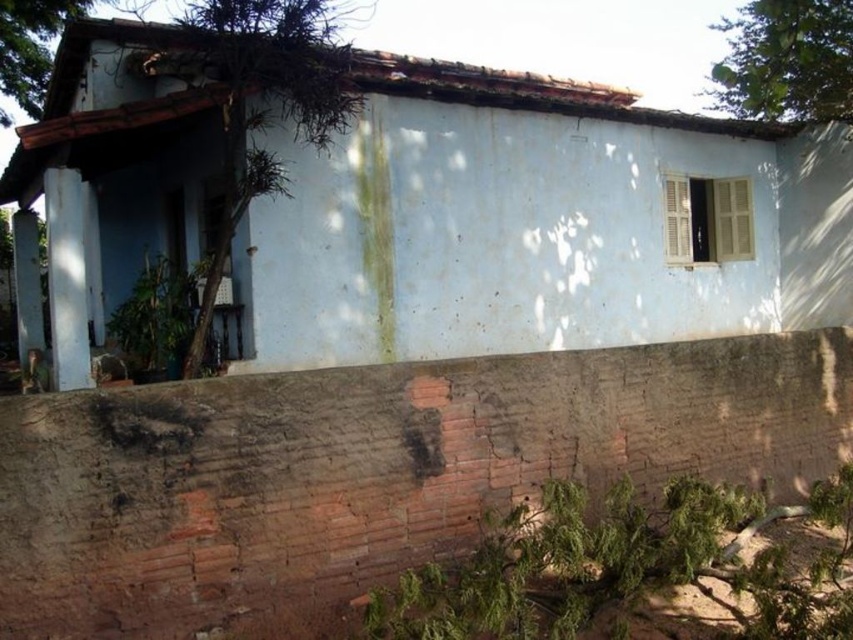
Question: Which point is farther to the camera?

Choices:
 (A) (846, 291)
 (B) (0, 13)
 (C) (851, 49)

Answer: (B)

Question: Which point is farther from the camera taking this photo?

Choices:
 (A) (781, 35)
 (B) (32, 65)

Answer: (B)

Question: Is green leafy tree at upper right below green mossy roof at upper left?

Choices:
 (A) yes
 (B) no

Answer: (B)

Question: Based on their relative distances, which object is farther from the white matte house at center?

Choices:
 (A) green leafy tree at upper right
 (B) green mossy roof at upper left

Answer: (B)

Question: Can you confirm if green leafy tree at upper right is positioned to the left of green mossy roof at upper left?

Choices:
 (A) no
 (B) yes

Answer: (A)

Question: Is white matte house at center positioned in front of green mossy roof at upper left?

Choices:
 (A) yes
 (B) no

Answer: (A)